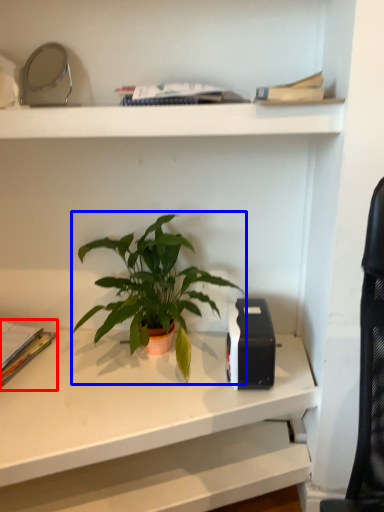
Question: Which of the following is the farthest to the observer, paperback book (highlighted by a red box) or houseplant (highlighted by a blue box)?

Choices:
 (A) paperback book
 (B) houseplant

Answer: (A)